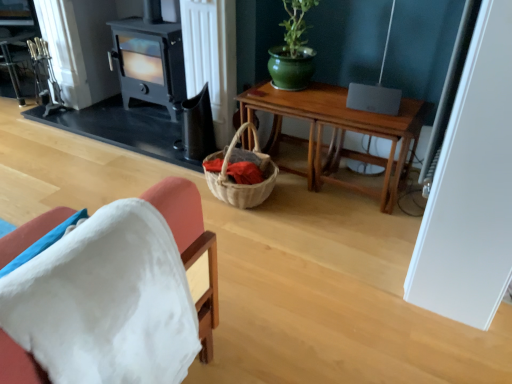
Question: Can you confirm if white fabric chair at lower left is taller than black matte fireplace at center?

Choices:
 (A) no
 (B) yes

Answer: (A)

Question: Could you tell me if white fabric chair at lower left is facing black matte fireplace at center?

Choices:
 (A) yes
 (B) no

Answer: (B)

Question: Is black matte fireplace at center completely or partially inside white fabric chair at lower left?

Choices:
 (A) no
 (B) yes

Answer: (A)

Question: Does white fabric chair at lower left lie behind black matte fireplace at center?

Choices:
 (A) yes
 (B) no

Answer: (B)

Question: Would you say white fabric chair at lower left is outside black matte fireplace at center?

Choices:
 (A) yes
 (B) no

Answer: (A)

Question: Is white fabric chair at lower left at the right side of black matte fireplace at center?

Choices:
 (A) no
 (B) yes

Answer: (B)

Question: Is wooden table at center shorter than black matte fireplace at center?

Choices:
 (A) yes
 (B) no

Answer: (A)

Question: From the image's perspective, would you say wooden table at center is shown under black matte fireplace at center?

Choices:
 (A) no
 (B) yes

Answer: (B)

Question: Considering the relative sizes of wooden table at center and black matte fireplace at center in the image provided, is wooden table at center taller than black matte fireplace at center?

Choices:
 (A) yes
 (B) no

Answer: (B)

Question: From a real-world perspective, is wooden table at center under black matte fireplace at center?

Choices:
 (A) no
 (B) yes

Answer: (B)

Question: Is wooden table at center surrounding black matte fireplace at center?

Choices:
 (A) no
 (B) yes

Answer: (A)

Question: Can you confirm if wooden table at center is smaller than black matte fireplace at center?

Choices:
 (A) no
 (B) yes

Answer: (A)

Question: From the image's perspective, is white fabric chair at lower left above wooden table at center?

Choices:
 (A) no
 (B) yes

Answer: (A)